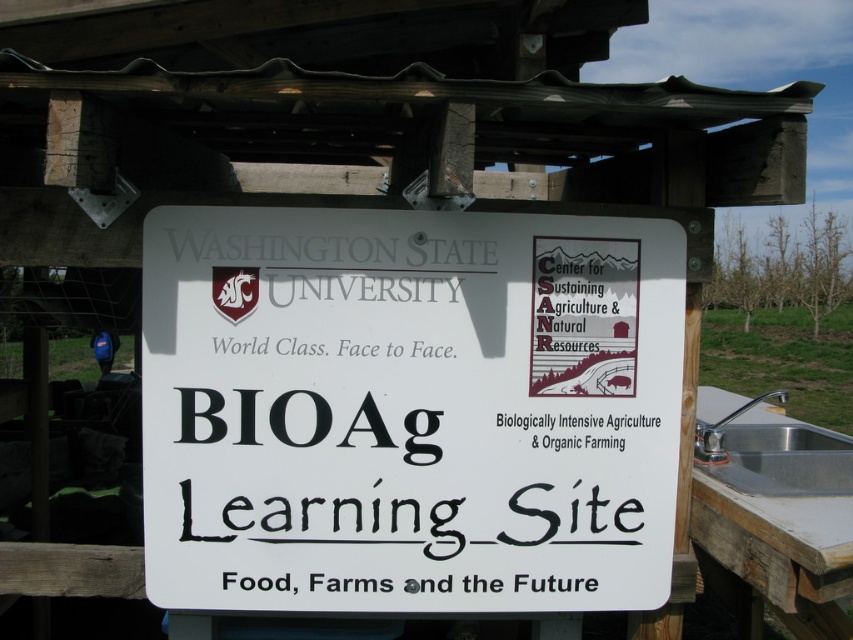
Can you confirm if white plastic sign at center is shorter than silver metallic sink at right?

Incorrect, white plastic sign at center's height does not fall short of silver metallic sink at right's.

Locate an element on the screen. The width and height of the screenshot is (853, 640). white plastic sign at center is located at coordinates (409, 410).